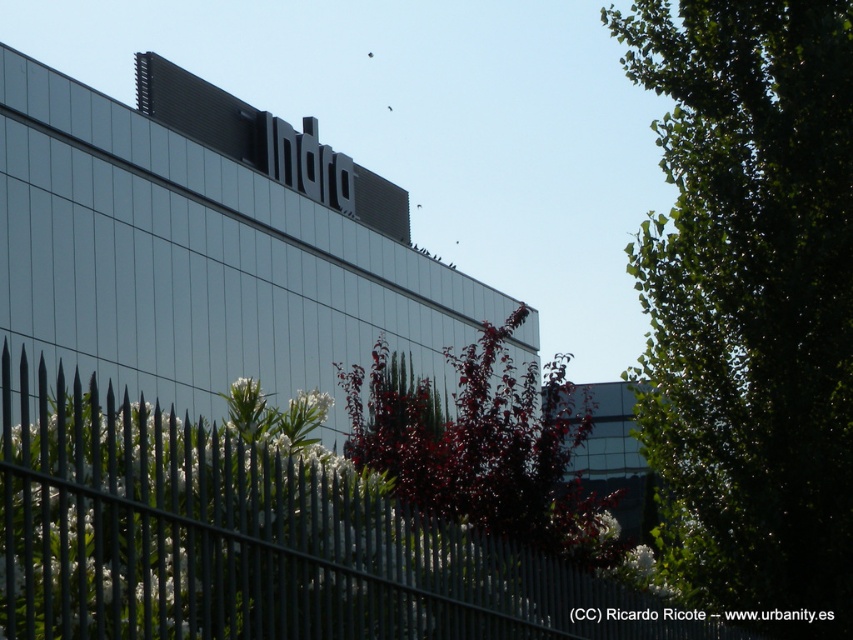
Question: Which point is closer to the camera taking this photo?

Choices:
 (A) (120, 625)
 (B) (572, 554)
 (C) (809, 131)

Answer: (A)

Question: Is green leafy tree at right above metallic gray fence at lower left?

Choices:
 (A) no
 (B) yes

Answer: (B)

Question: Which point appears closest to the camera in this image?

Choices:
 (A) (397, 554)
 (B) (646, 280)

Answer: (A)

Question: Which point is closer to the camera?

Choices:
 (A) metallic gray fence at lower left
 (B) green leafy tree at right

Answer: (A)

Question: Is green leafy tree at right below dark red leafy tree at center?

Choices:
 (A) no
 (B) yes

Answer: (A)

Question: Does green leafy tree at right have a greater width compared to dark red leafy tree at center?

Choices:
 (A) no
 (B) yes

Answer: (A)